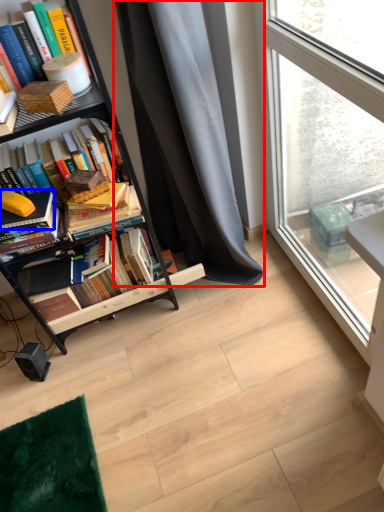
Question: Among these objects, which one is nearest to the camera, curtain (highlighted by a red box) or book (highlighted by a blue box)?

Choices:
 (A) curtain
 (B) book

Answer: (A)